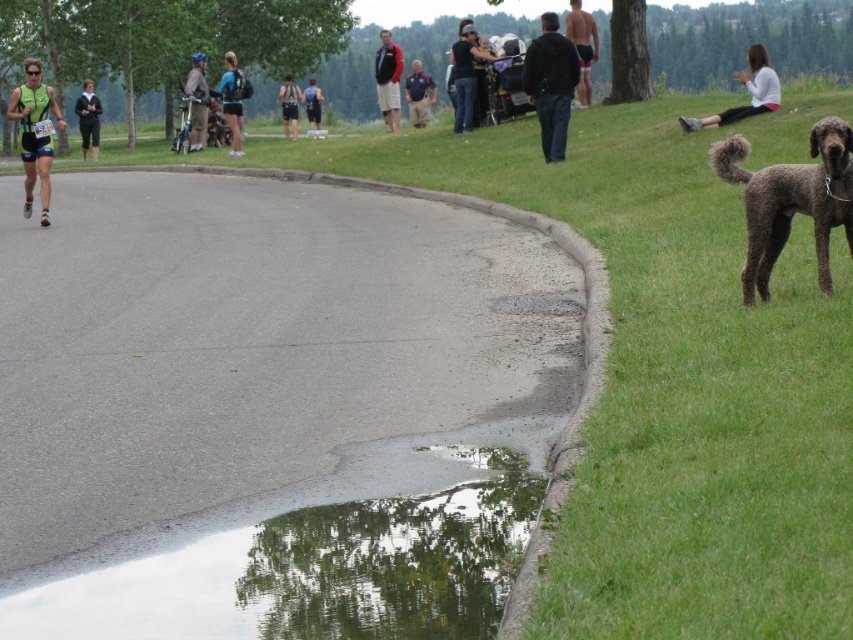
Question: Which point is farther from the camera taking this photo?

Choices:
 (A) pos(759,234)
 (B) pos(576,17)

Answer: (B)

Question: Estimate the real-world distances between objects in this image. Which object is farther from the red mesh shorts at center?

Choices:
 (A) white fabric pants at upper right
 (B) clear water at lower left

Answer: (B)

Question: Which of the following is the closest to the observer?

Choices:
 (A) (234, 140)
 (B) (33, 92)
 (C) (756, 90)

Answer: (B)

Question: Is matte black jacket at center positioned behind red jacket at center?

Choices:
 (A) no
 (B) yes

Answer: (A)

Question: Considering the relative positions of matte blue helmet at upper left and green fabric shirt at center in the image provided, where is matte blue helmet at upper left located with respect to green fabric shirt at center?

Choices:
 (A) below
 (B) above

Answer: (A)

Question: Is clear water at lower left thinner than blue cotton shirt at center?

Choices:
 (A) yes
 (B) no

Answer: (B)